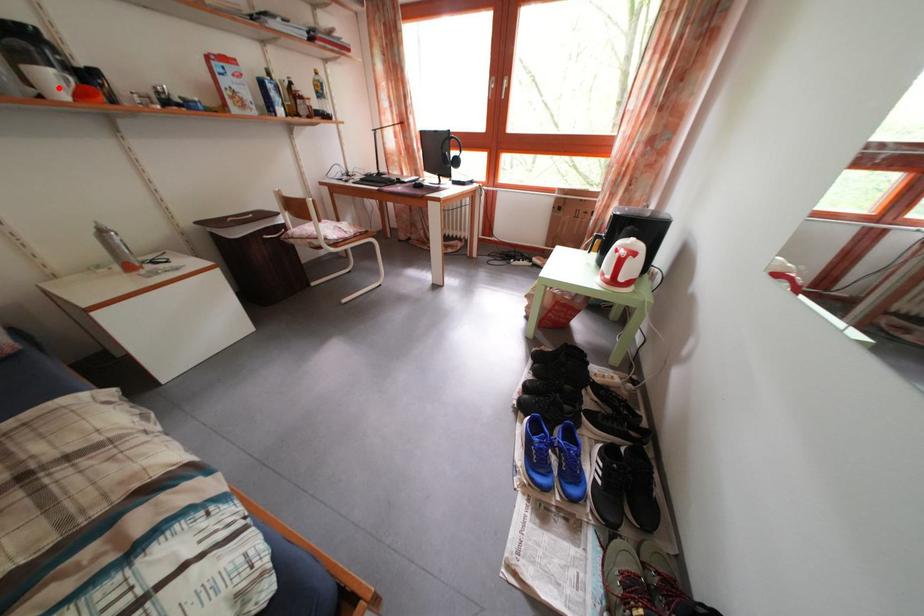
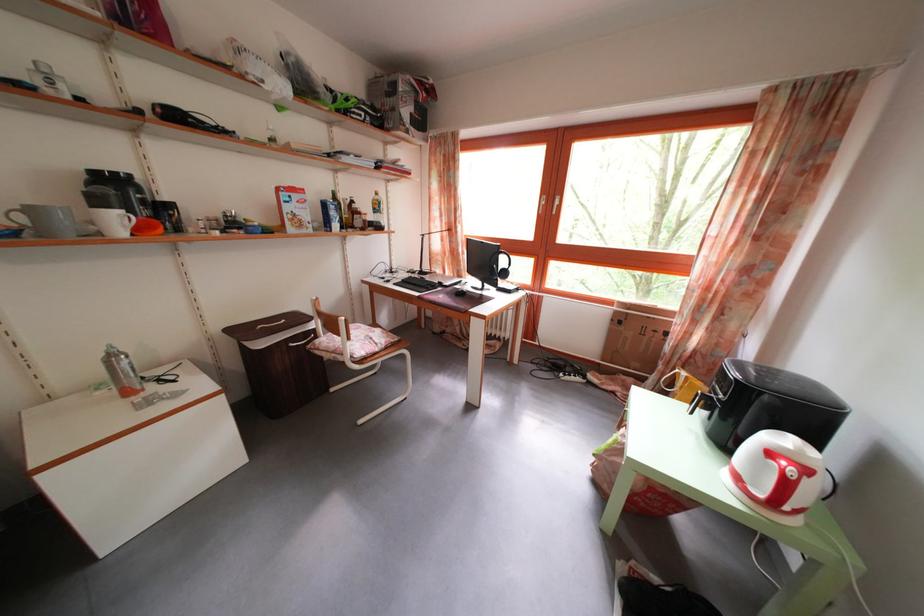
Find the pixel in the second image that matches the highlighted location in the first image.

(125, 227)